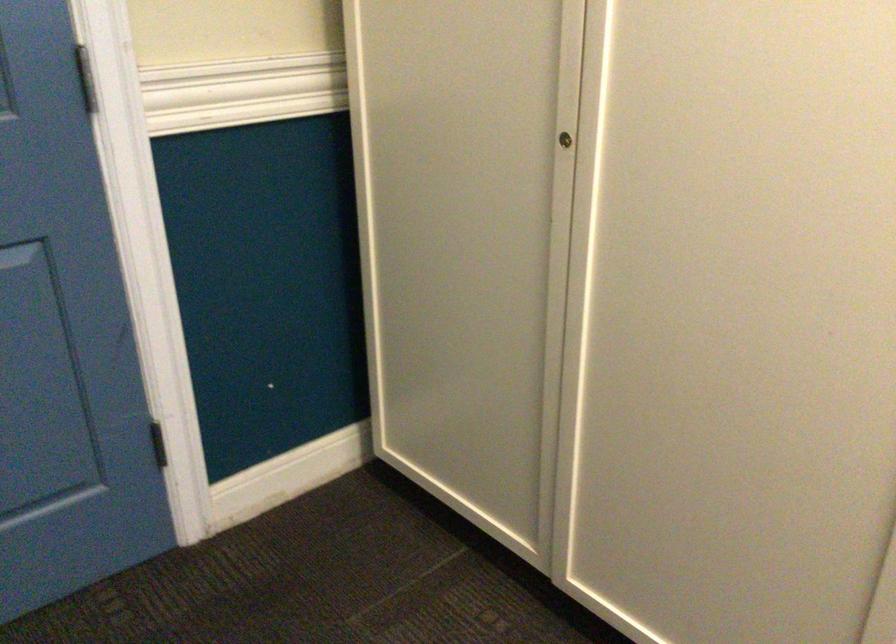
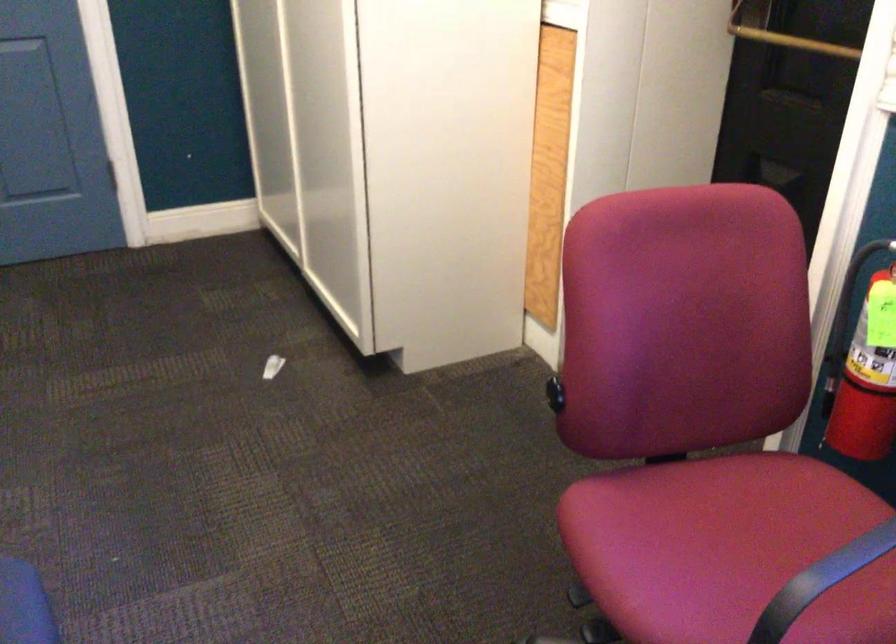
What movement of the cameraman would produce the second image?

The cameraman moved toward right, backward.